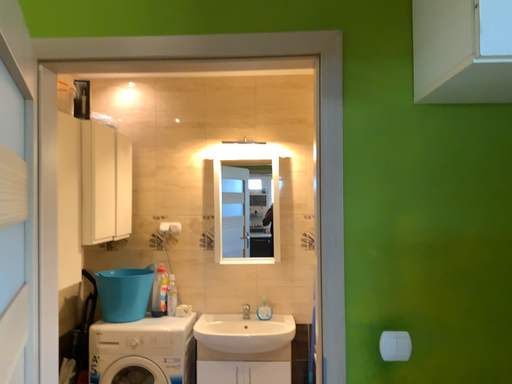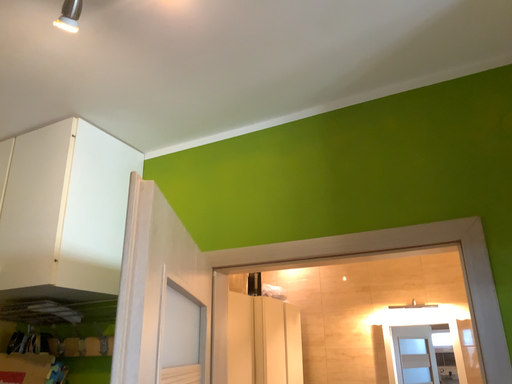
Question: How did the camera likely rotate when shooting the video?

Choices:
 (A) rotated left
 (B) rotated right

Answer: (A)